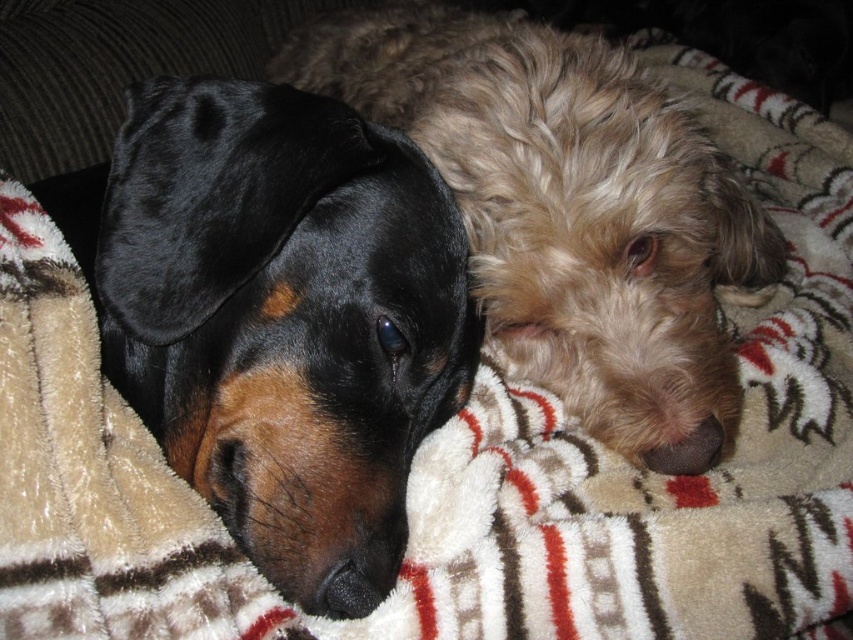
You are standing in front of the image and want to place a small toy between the black velvet dog at left and the other dog. According to their positions, where should you place the toy to ensure it is exactly halfway between them?

The black velvet dog at left is located at point [285,320]. To place the toy exactly halfway between them, you would need to calculate the midpoint between the coordinates of the black velvet dog at left and the other dog. However, the coordinates of the other dog are not provided in the Objects Description, so it is impossible to determine the exact halfway point without that information.

You are a dog owner who wants to place a new dog bed between the black velvet dog at left and the shaggy beige dog at center. The bed requires 1.2 meters of space. Can the bed fit between them?

The black velvet dog at left is smaller than the shaggy beige dog at center, but there is no information provided about the distance between them. Therefore, it is impossible to determine if the bed will fit.